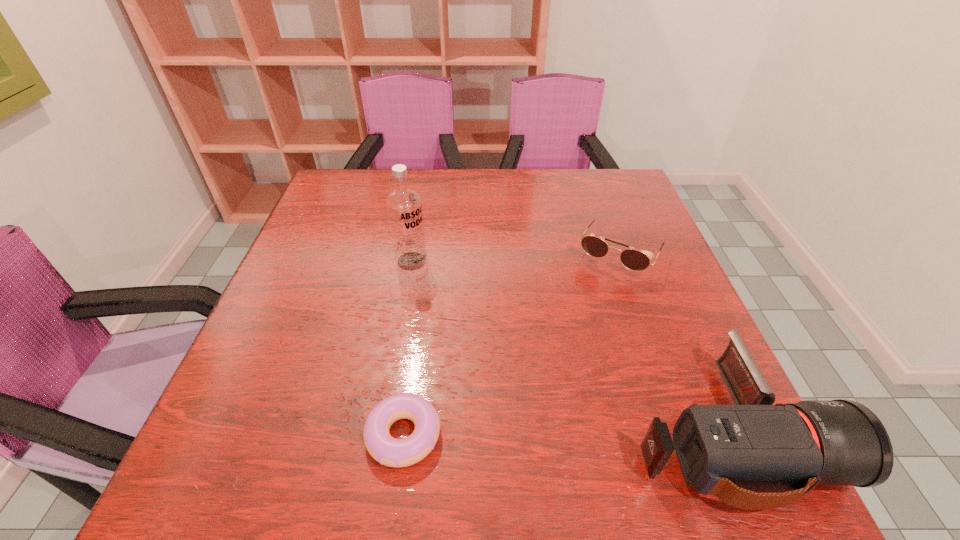
Identify the location of vacant region between the third tallest object and the vodka. (516, 258).

What are the coordinates of `vacant space in between the third tallest object and the second tallest object` in the screenshot? It's located at (672, 343).

Where is `the closest object relative to the camcorder`? the closest object relative to the camcorder is located at coordinates (635, 260).

You are a GUI agent. You are given a task and a screenshot of the screen. Output one action in this format:
    pyautogui.click(x=<x>, y=<y>)
    Task: Click on the object that is the closest to the vodka
    This screenshot has height=540, width=960.
    Given the screenshot: What is the action you would take?
    pyautogui.click(x=388, y=451)

Identify the location of free space that satisfies the following two spatial constraints: 1. on the front side of the sunglasses; 2. on the lens of the third shortest object. The image size is (960, 540). (684, 433).

Image resolution: width=960 pixels, height=540 pixels. Identify the location of blank area in the image that satisfies the following two spatial constraints: 1. on the front side of the shortest object; 2. on the left side of the vodka. (382, 435).

Identify the location of vacant area that satisfies the following two spatial constraints: 1. on the front side of the camcorder; 2. on the lens of the third tallest object. This screenshot has height=540, width=960. (684, 433).

Identify the location of free space that satisfies the following two spatial constraints: 1. on the front side of the camcorder; 2. on the lens of the sunglasses. (684, 433).